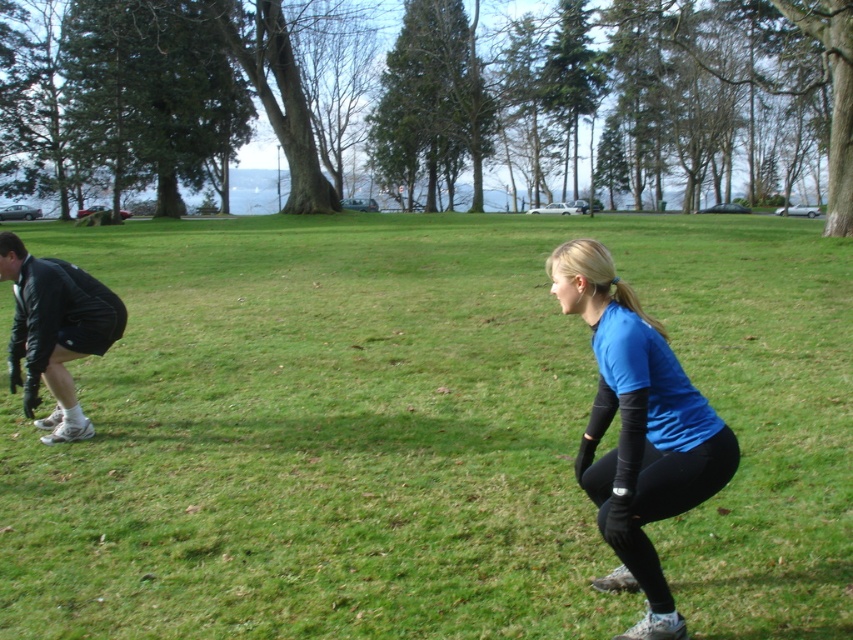
Question: Which of the following is the farthest from the observer?

Choices:
 (A) (61, 301)
 (B) (651, 520)

Answer: (A)

Question: Estimate the real-world distances between objects in this image. Which object is closer to the black leather jacket at lower left?

Choices:
 (A) blue fabric shirt at center
 (B) blue fabric at center

Answer: (A)

Question: Which is farther from the blue fabric at center?

Choices:
 (A) black leather jacket at lower left
 (B) blue fabric shirt at center

Answer: (B)

Question: Can you confirm if blue fabric at center is positioned above blue fabric shirt at center?

Choices:
 (A) yes
 (B) no

Answer: (A)

Question: Is blue fabric at center positioned before blue fabric shirt at center?

Choices:
 (A) yes
 (B) no

Answer: (B)

Question: Is the position of blue fabric at center less distant than that of black leather jacket at lower left?

Choices:
 (A) yes
 (B) no

Answer: (A)